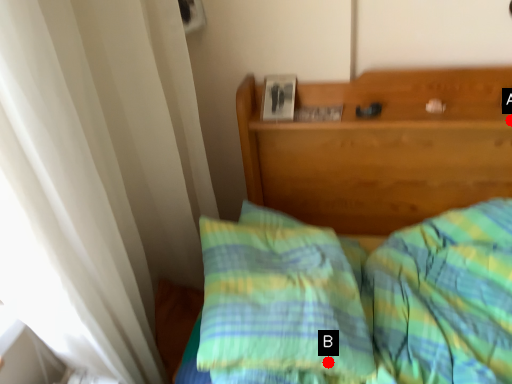
Question: Two points are circled on the image, labeled by A and B beside each circle. Among these points, which one is farthest from the camera?

Choices:
 (A) A is further
 (B) B is further

Answer: (A)